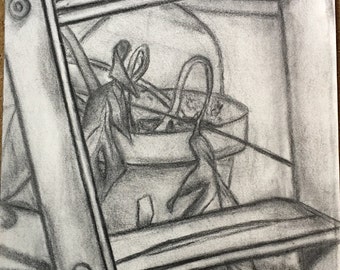
Find the location of a particular element. art is located at coordinates (140, 253).